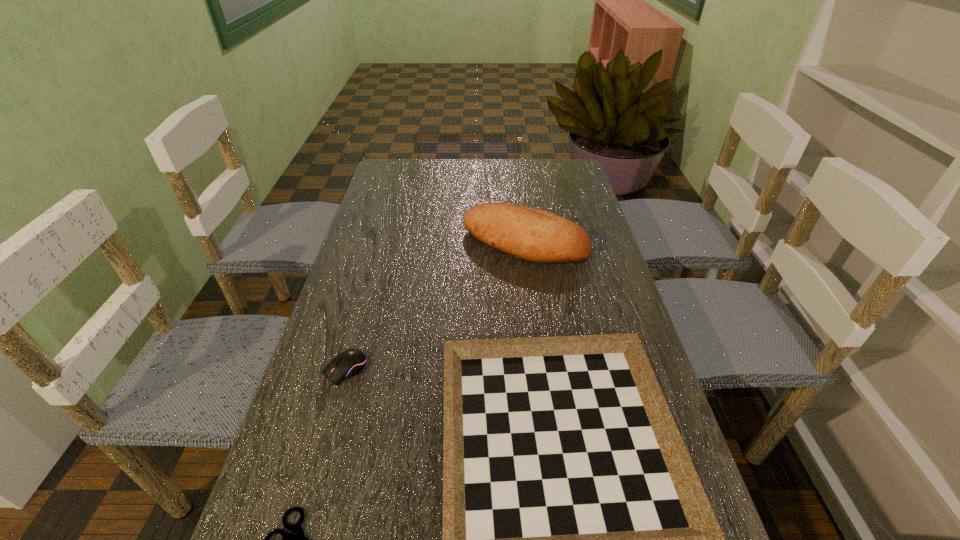
Where is `the tallest object`? the tallest object is located at coordinates (531, 234).

Locate an element on the screen. This screenshot has width=960, height=540. the farthest object is located at coordinates (531, 234).

Identify the location of computer mouse. tap(349, 363).

Image resolution: width=960 pixels, height=540 pixels. In order to click on vacant region located 0.070m on the left of the bread in this screenshot , I will do `click(440, 242)`.

At what (x,y) coordinates should I click in order to perform the action: click on free space located on the back of the computer mouse. Please return your answer as a coordinate pair (x, y). Looking at the image, I should click on (378, 254).

Where is `object located at the left edge`? The width and height of the screenshot is (960, 540). object located at the left edge is located at coordinates (349, 363).

The width and height of the screenshot is (960, 540). In order to click on object at the right edge in this screenshot , I will do `click(531, 234)`.

At what (x,y) coordinates should I click in order to perform the action: click on vacant space at the far edge. Please return your answer as a coordinate pair (x, y). The image size is (960, 540). Looking at the image, I should click on (431, 173).

Identify the location of vacant region at the left edge. (352, 285).

The height and width of the screenshot is (540, 960). I want to click on vacant space at the right edge, so click(576, 303).